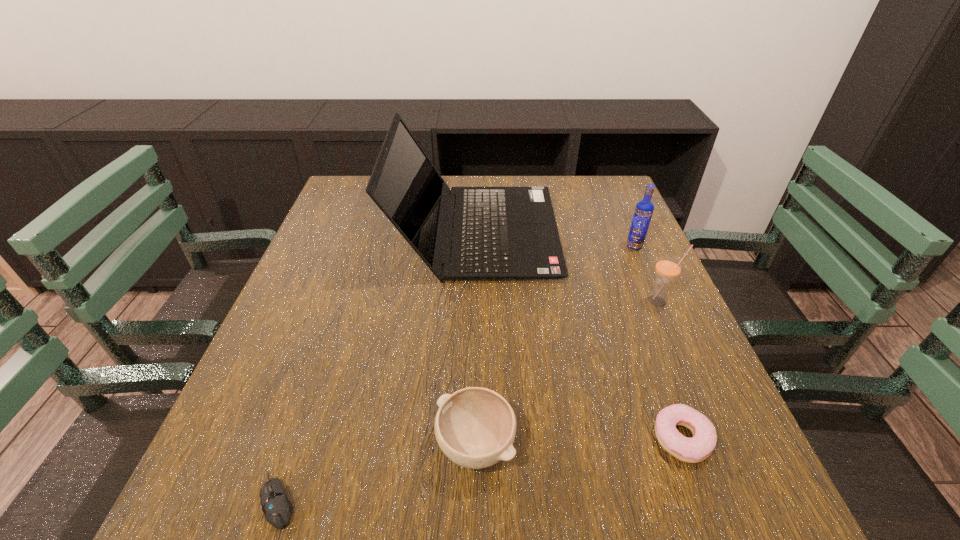
Where is `free space that satisfies the following two spatial constraints: 1. on the screen of the tallest object; 2. on the back side of the third farthest object`? Image resolution: width=960 pixels, height=540 pixels. free space that satisfies the following two spatial constraints: 1. on the screen of the tallest object; 2. on the back side of the third farthest object is located at coordinates coord(474,301).

Where is `free spot that satisfies the following two spatial constraints: 1. on the screen of the laptop computer; 2. on the right side of the second shortest object`? free spot that satisfies the following two spatial constraints: 1. on the screen of the laptop computer; 2. on the right side of the second shortest object is located at coordinates (473, 438).

Locate an element on the screen. The width and height of the screenshot is (960, 540). vacant space that satisfies the following two spatial constraints: 1. on the screen of the tallest object; 2. on the right side of the fourth nearest object is located at coordinates (474, 301).